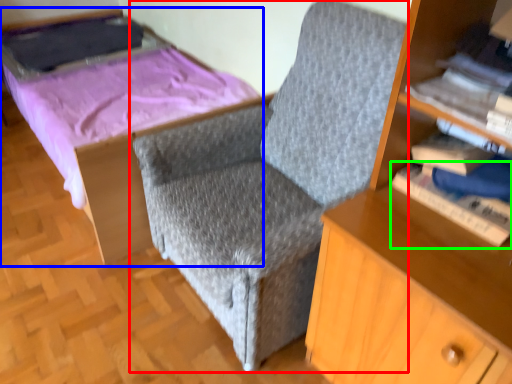
Question: Which object is positioned farthest from chair (highlighted by a red box)? Select from bed (highlighted by a blue box) and book (highlighted by a green box).

Choices:
 (A) bed
 (B) book

Answer: (A)